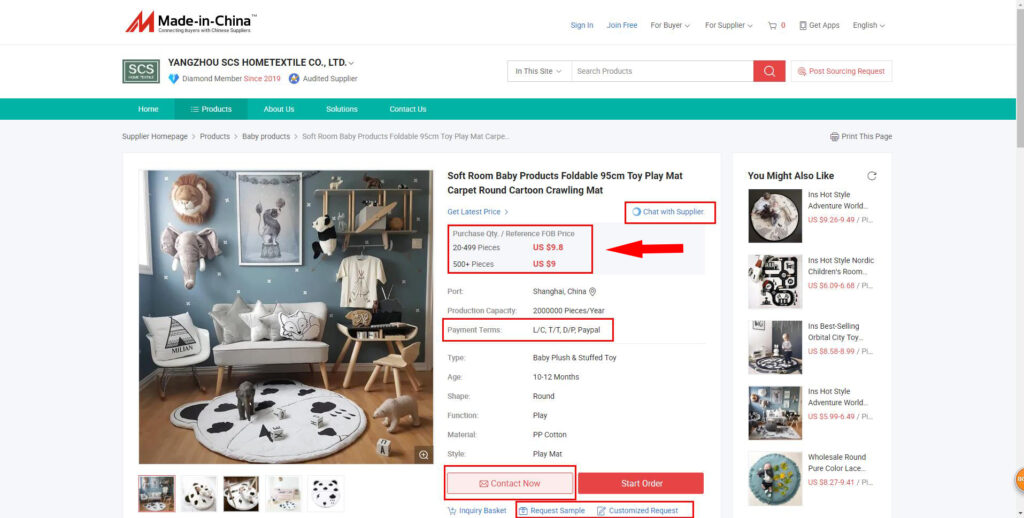
You are a GUI agent. You are given a task and a screenshot of the screen. Output one action in this format:
    pyautogui.click(x=<x>, y=<y>)
    Task: Click on the white seating
    
    Given the screenshot: What is the action you would take?
    pyautogui.click(x=266, y=351)